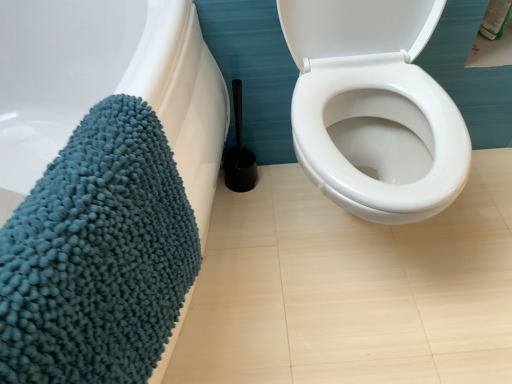
Question: Would you say teal chenille bath towel at left is inside or outside black plastic toilet brush at center?

Choices:
 (A) inside
 (B) outside

Answer: (B)

Question: From the image's perspective, is teal chenille bath towel at left positioned above or below black plastic toilet brush at center?

Choices:
 (A) above
 (B) below

Answer: (B)

Question: Is teal chenille bath towel at left wider or thinner than black plastic toilet brush at center?

Choices:
 (A) thin
 (B) wide

Answer: (B)

Question: In terms of height, does black plastic toilet brush at center look taller or shorter compared to teal chenille bath towel at left?

Choices:
 (A) short
 (B) tall

Answer: (A)

Question: From the image's perspective, is black plastic toilet brush at center above or below teal chenille bath towel at left?

Choices:
 (A) below
 (B) above

Answer: (B)

Question: Visually, is black plastic toilet brush at center positioned to the left or to the right of teal chenille bath towel at left?

Choices:
 (A) right
 (B) left

Answer: (A)

Question: Is black plastic toilet brush at center in front of or behind teal chenille bath towel at left in the image?

Choices:
 (A) front
 (B) behind

Answer: (B)